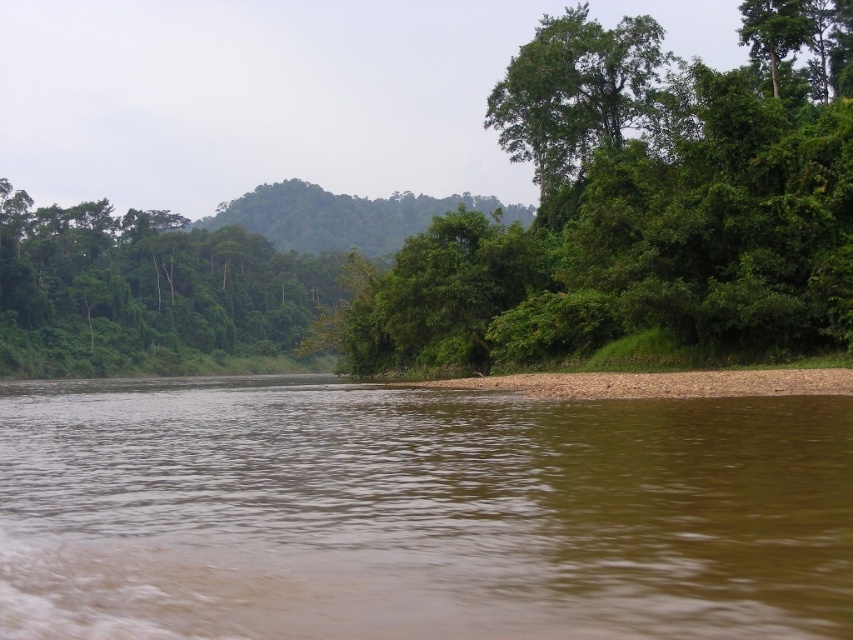
Question: Which object appears farthest from the camera in this image?

Choices:
 (A) brown muddy water at lower center
 (B) green leafy tree at center
 (C) green leafy tree at upper center
 (D) green leafy trees at left

Answer: (D)

Question: Can you confirm if brown muddy water at lower center is positioned to the right of green leafy tree at center?

Choices:
 (A) yes
 (B) no

Answer: (B)

Question: Which of the following is the farthest from the observer?

Choices:
 (A) green leafy tree at center
 (B) green leafy tree at upper center

Answer: (B)

Question: Does green leafy tree at center appear under green leafy tree at upper center?

Choices:
 (A) yes
 (B) no

Answer: (A)

Question: Which object appears farthest from the camera in this image?

Choices:
 (A) brown muddy water at lower center
 (B) green leafy trees at left

Answer: (B)

Question: Is the position of green leafy tree at center less distant than that of green leafy tree at upper center?

Choices:
 (A) yes
 (B) no

Answer: (A)